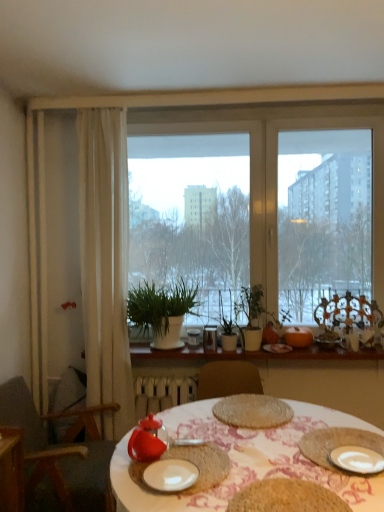
At what (x,y) coordinates should I click in order to perform the action: click on vacant space to the right of matte red teapot at center, acting as the 1th tableware starting from the front. Please return your answer as a coordinate pair (x, y). This screenshot has width=384, height=512. Looking at the image, I should click on coord(273,465).